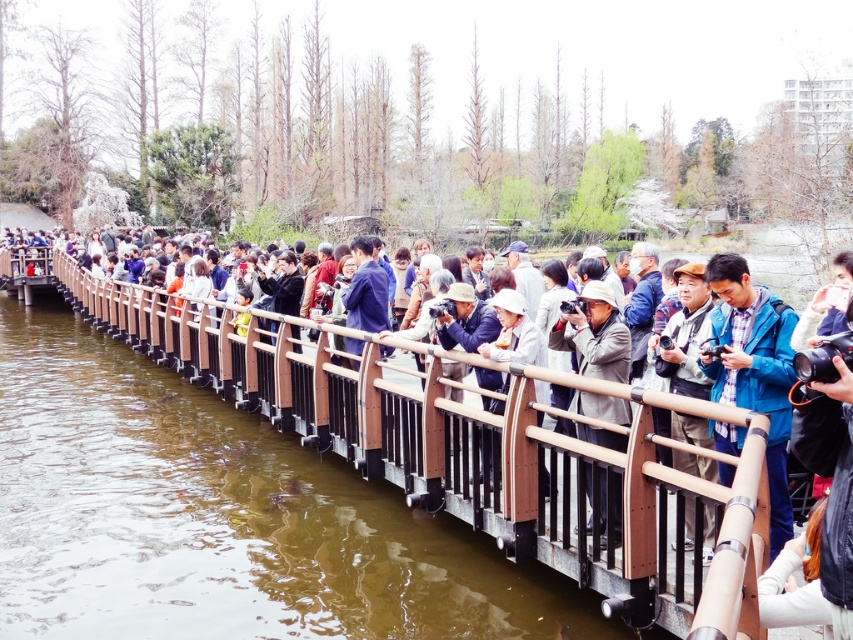
Question: Which is nearer to the brown wooden bridge at center?

Choices:
 (A) gray fabric hat at center
 (B) white matte hat at center
 (C) matte brown camera at center

Answer: (A)

Question: Is brown wooden bridge at center further to camera compared to gray fabric hat at center?

Choices:
 (A) yes
 (B) no

Answer: (B)

Question: Which object appears farthest from the camera in this image?

Choices:
 (A) matte brown camera at center
 (B) brown wooden bridge at center
 (C) white matte hat at center
 (D) gray fabric hat at center

Answer: (C)

Question: Which of the following is the farthest from the observer?

Choices:
 (A) (54, 552)
 (B) (494, 300)
 (C) (688, 385)
 (D) (612, 346)

Answer: (A)

Question: Does gray fabric hat at center have a greater width compared to white matte hat at center?

Choices:
 (A) no
 (B) yes

Answer: (A)

Question: Can you confirm if gray fabric hat at center is positioned to the left of matte brown camera at center?

Choices:
 (A) no
 (B) yes

Answer: (B)